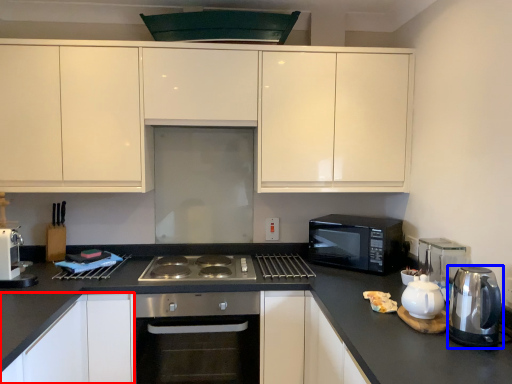
Question: Which point is closer to the camera, cabinetry (highlighted by a red box) or kitchen appliance (highlighted by a blue box)?

Choices:
 (A) cabinetry
 (B) kitchen appliance

Answer: (B)